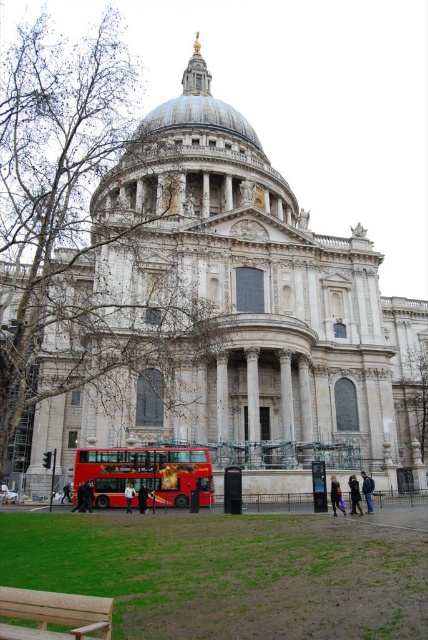
Question: Is white stone cathedral at center to the left of green grass at lower left from the viewer's perspective?

Choices:
 (A) no
 (B) yes

Answer: (A)

Question: Does dark blue jacket at lower center have a lesser width compared to dark blue leather jacket at lower center?

Choices:
 (A) no
 (B) yes

Answer: (B)

Question: Estimate the real-world distances between objects in this image. Which object is farther from the dark blue jacket at lower center?

Choices:
 (A) dark gray coat at lower center
 (B) red metallic double-decker bus at lower center
 (C) dark blue leather jacket at lower center

Answer: (B)

Question: Which is farther from the black fabric coat at center?

Choices:
 (A) dark blue jacket at center
 (B) dark blue leather jacket at lower center
 (C) green grass at lower left

Answer: (B)

Question: In this image, where is white stone cathedral at center located relative to black fabric coat at center?

Choices:
 (A) left
 (B) right

Answer: (B)

Question: Which object is farther from the camera taking this photo?

Choices:
 (A) white stone cathedral at center
 (B) dark gray coat at lower center
 (C) wooden bench at lower left
 (D) dark blue jacket at lower center

Answer: (D)